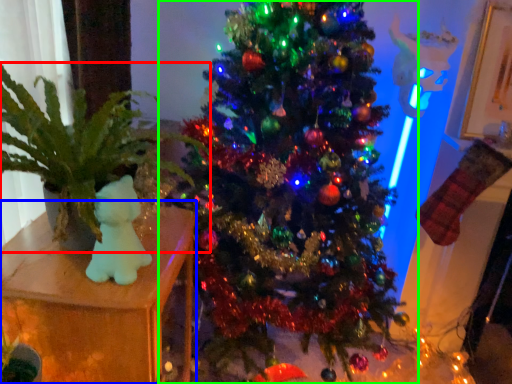
Question: Based on their relative distances, which object is farther from houseplant (highlighted by a red box)? Choose from furniture (highlighted by a blue box) and christmas tree (highlighted by a green box).

Choices:
 (A) furniture
 (B) christmas tree

Answer: (B)